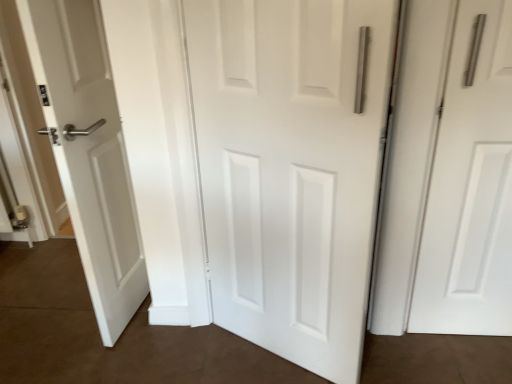
Question: Should I look upward or downward to see white matte door at center, the 1th door in the left-to-right sequence?

Choices:
 (A) down
 (B) up

Answer: (A)

Question: Considering the relative positions of white matte door at center, the 2th door when ordered from right to left, and white matte door at right, arranged as the 2th door when viewed from the left, in the image provided, is white matte door at center, the 2th door when ordered from right to left, to the right of white matte door at right, arranged as the 2th door when viewed from the left, from the viewer's perspective?

Choices:
 (A) no
 (B) yes

Answer: (A)

Question: Does white matte door at center, the 1th door in the left-to-right sequence, lie in front of white matte door at right, arranged as the 2th door when viewed from the left?

Choices:
 (A) yes
 (B) no

Answer: (A)

Question: Is white matte door at center, the 1th door in the left-to-right sequence, aimed at white matte door at right, arranged as the 2th door when viewed from the left?

Choices:
 (A) no
 (B) yes

Answer: (A)

Question: From the image's perspective, would you say white matte door at center, the 1th door in the left-to-right sequence, is positioned over white matte door at right, which ranks as the first door in right-to-left order?

Choices:
 (A) no
 (B) yes

Answer: (A)

Question: Does white matte door at center, the 2th door when ordered from right to left, have a lesser height compared to white matte door at right, arranged as the 2th door when viewed from the left?

Choices:
 (A) yes
 (B) no

Answer: (B)

Question: From the image's perspective, is white matte door at center, the 2th door when ordered from right to left, beneath white matte door at right, which ranks as the first door in right-to-left order?

Choices:
 (A) no
 (B) yes

Answer: (B)

Question: Can you confirm if white matte door at right, arranged as the 2th door when viewed from the left, is wider than white matte door at center, the 2th door when ordered from right to left?

Choices:
 (A) yes
 (B) no

Answer: (A)

Question: Can you confirm if white matte door at right, arranged as the 2th door when viewed from the left, is smaller than white matte door at center, the 2th door when ordered from right to left?

Choices:
 (A) no
 (B) yes

Answer: (B)

Question: Does white matte door at right, arranged as the 2th door when viewed from the left, have a larger size compared to white matte door at center, the 2th door when ordered from right to left?

Choices:
 (A) yes
 (B) no

Answer: (B)

Question: Can you confirm if white matte door at right, which ranks as the first door in right-to-left order, is thinner than white matte door at center, the 2th door when ordered from right to left?

Choices:
 (A) no
 (B) yes

Answer: (A)

Question: Could you tell me if white matte door at right, which ranks as the first door in right-to-left order, is turned towards white matte door at center, the 2th door when ordered from right to left?

Choices:
 (A) no
 (B) yes

Answer: (A)

Question: From a real-world perspective, is white matte door at right, arranged as the 2th door when viewed from the left, below white matte door at center, the 2th door when ordered from right to left?

Choices:
 (A) no
 (B) yes

Answer: (B)

Question: From a real-world perspective, is white matte door at right, arranged as the 2th door when viewed from the left, above or below white matte door at center, the 2th door when ordered from right to left?

Choices:
 (A) above
 (B) below

Answer: (B)